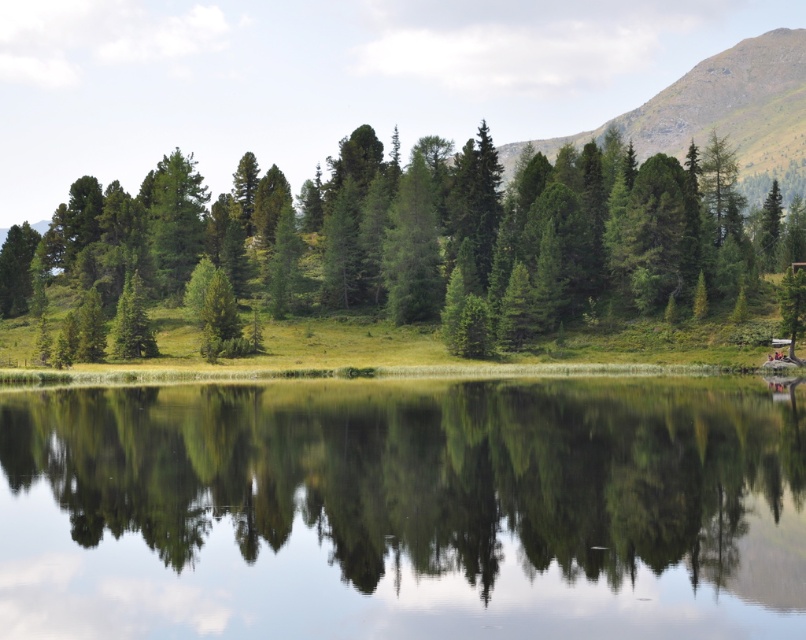
Question: Can you confirm if green matte tree at center is positioned to the left of green grassy mountain at upper right?

Choices:
 (A) yes
 (B) no

Answer: (A)

Question: Does green matte tree at center have a greater width compared to green grassy mountain at upper right?

Choices:
 (A) no
 (B) yes

Answer: (A)

Question: Which is farther from the clear water at center?

Choices:
 (A) green matte tree at center
 (B) green grassy mountain at upper right

Answer: (B)

Question: Which point is closer to the camera taking this photo?

Choices:
 (A) (435, 236)
 (B) (796, 42)

Answer: (A)

Question: Which of the following is the farthest from the observer?

Choices:
 (A) coord(314,196)
 (B) coord(185,467)

Answer: (A)

Question: Does green matte tree at center appear under green grassy mountain at upper right?

Choices:
 (A) yes
 (B) no

Answer: (A)